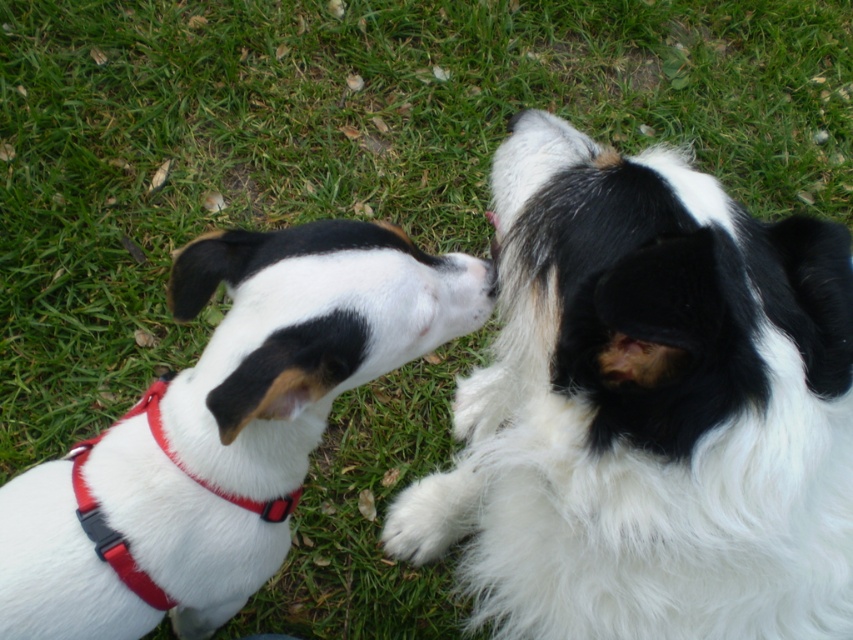
Question: Which point is farther to the camera?

Choices:
 (A) (223, 337)
 (B) (523, 532)
 (C) (184, 470)

Answer: (C)

Question: Is white fur dog at center to the right of red fabric neckband at lower left from the viewer's perspective?

Choices:
 (A) no
 (B) yes

Answer: (A)

Question: Does white fluffy dog at upper center appear under red fabric neckband at lower left?

Choices:
 (A) no
 (B) yes

Answer: (A)

Question: Is white fur dog at center to the left of red fabric neckband at lower left from the viewer's perspective?

Choices:
 (A) yes
 (B) no

Answer: (A)

Question: Which of these objects is positioned farthest from the red fabric neckband at lower left?

Choices:
 (A) white fluffy dog at upper center
 (B) white fur dog at center

Answer: (A)

Question: Among these objects, which one is nearest to the camera?

Choices:
 (A) red fabric neckband at lower left
 (B) white fur dog at center

Answer: (B)